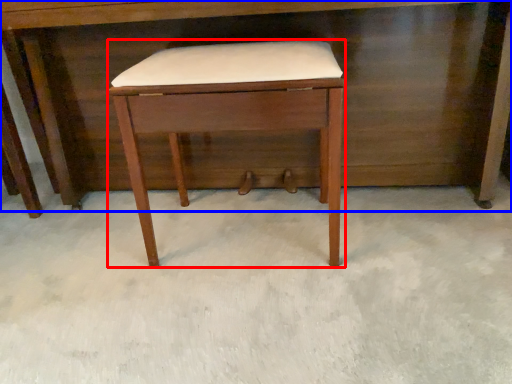
Question: Among these objects, which one is nearest to the camera, stool (highlighted by a red box) or desk (highlighted by a blue box)?

Choices:
 (A) stool
 (B) desk

Answer: (A)